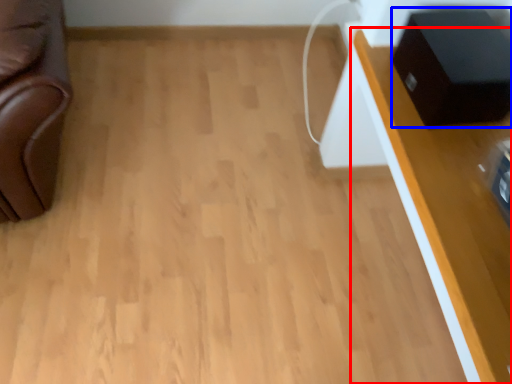
Question: Which of the following is the closest to the observer, table (highlighted by a red box) or speaker (highlighted by a blue box)?

Choices:
 (A) table
 (B) speaker

Answer: (A)